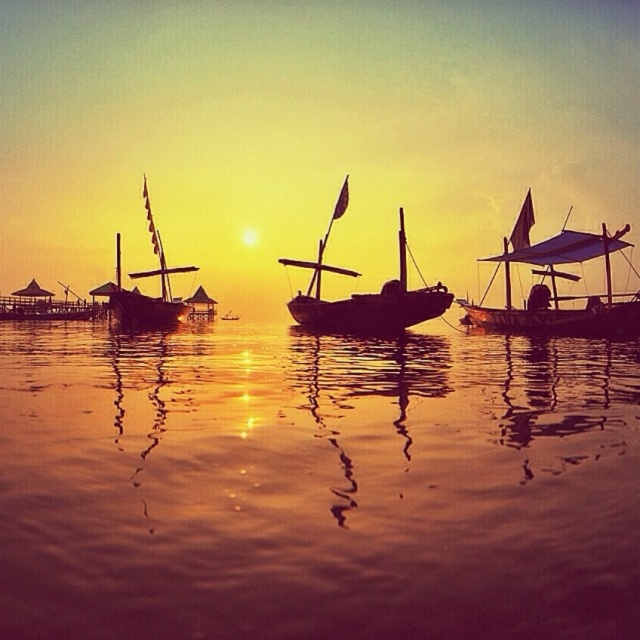
Does wooden sailboat at right have a lesser width compared to brushed metal boat at center?

Incorrect, wooden sailboat at right's width is not less than brushed metal boat at center's.

Is wooden sailboat at right to the right of brushed metal boat at center from the viewer's perspective?

Indeed, wooden sailboat at right is positioned on the right side of brushed metal boat at center.

Locate an element on the screen. The width and height of the screenshot is (640, 640). wooden sailboat at right is located at coordinates (556, 285).

Is point (289, 624) behind point (220, 316)?

No, (289, 624) is closer to viewer.

Which is in front, point (188, 468) or point (232, 320)?

Point (188, 468) is more forward.

Locate an element on the screen. The height and width of the screenshot is (640, 640). shiny golden water at center is located at coordinates (316, 484).

Between wooden boat at left and brushed metal boat at center, which one has more height?

wooden boat at left is taller.

Consider the image. Does wooden boat at left have a lesser height compared to brushed metal boat at center?

No, wooden boat at left is not shorter than brushed metal boat at center.

The image size is (640, 640). Describe the element at coordinates (44, 305) in the screenshot. I see `wooden boat at left` at that location.

In order to click on wooden boat at left in this screenshot , I will do `click(44, 305)`.